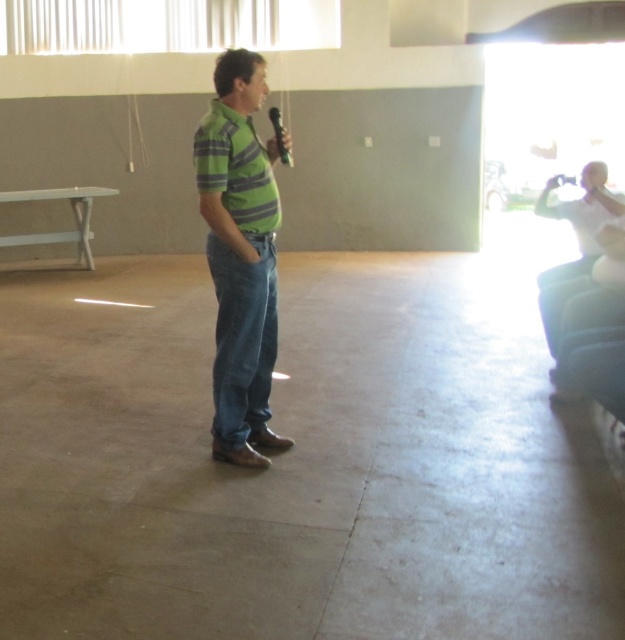
You are a stagehand responsible for adjusting the distance between the green striped shirt at center and the metallic shiny microphone at center. The ideal distance for optimal sound quality is between 12 to 18 inches. Based on the current distance of 31.48 inches, what adjustment should you make?

The green striped shirt at center is currently 31.48 inches away from the metallic shiny microphone at center, which is beyond the optimal range of 12 to 18 inches. To achieve better sound quality, you should move the microphone closer to the green striped shirt at center until it reaches within the recommended distance range.

You are organizing a small event and need to ensure the microphone is visible to the audience. Given the green striped shirt at center and the metallic shiny microphone at center, which object should be placed closer to the front to ensure visibility?

The metallic shiny microphone at center should be placed closer to the front since the green striped shirt at center is larger in size and might obstruct the view of the microphone if it is positioned behind.

You are attending a community event and want to take a photo of the speaker. The speaker is wearing a green striped shirt at center and holding a metallic shiny microphone at center. Based on their positions, which object is closer to the camera?

The green striped shirt at center is closer to the camera because it is in front of the metallic shiny microphone at center.